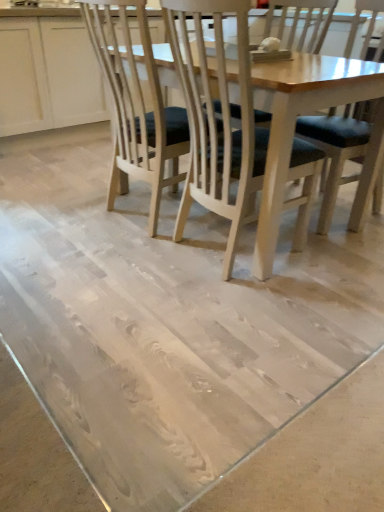
What is the approximate width of dark blue fabric chair at center, placed as the second chair when sorted from left to right?

The width of dark blue fabric chair at center, placed as the second chair when sorted from left to right, is 23.91 inches.

In order to face white wood cabinet at upper left, should I rotate leftwards or rightwards?

You should rotate left by 16.226 degrees.

You are a GUI agent. You are given a task and a screenshot of the screen. Output one action in this format:
    pyautogui.click(x=<x>, y=<y>)
    Task: Click on the dark blue fabric chair at center, placed as the second chair when sorted from left to right
    Image resolution: width=384 pixels, height=512 pixels.
    Given the screenshot: What is the action you would take?
    pyautogui.click(x=336, y=150)

Would you say white wood cabinet at upper left is outside dark blue fabric chair at center, which is the 1th chair in right-to-left order?

white wood cabinet at upper left lies outside dark blue fabric chair at center, which is the 1th chair in right-to-left order,'s area.

The height and width of the screenshot is (512, 384). Identify the location of the 2nd chair above the white wood cabinet at upper left (from a real-world perspective). (336, 150).

Can you tell me how much white wood cabinet at upper left and dark blue fabric chair at center, placed as the second chair when sorted from left to right, differ in facing direction?

The angle between the facing direction of white wood cabinet at upper left and the facing direction of dark blue fabric chair at center, placed as the second chair when sorted from left to right, is 88.8 degrees.

Which of these two, dark blue fabric chair at center, which is the 1th chair in right-to-left order, or white wood cabinet at upper left, is wider?

Wider between the two is white wood cabinet at upper left.

Which point is more forward, [322,231] or [1,74]?

The point [322,231] is closer to the camera.

Image resolution: width=384 pixels, height=512 pixels. Find the location of `cabinetry on the left of dark blue fabric chair at center, placed as the second chair when sorted from left to right`. cabinetry on the left of dark blue fabric chair at center, placed as the second chair when sorted from left to right is located at coordinates (48, 75).

From the image's perspective, is dark blue fabric chair at center, placed as the second chair when sorted from left to right, above or below white wood cabinet at upper left?

dark blue fabric chair at center, placed as the second chair when sorted from left to right, is below white wood cabinet at upper left.

Considering the relative positions of dark blue fabric chair at center, which is the 1th chair in right-to-left order, and wooden chair with dark cushion at center, which appears as the first chair when viewed from the left, in the image provided, is dark blue fabric chair at center, which is the 1th chair in right-to-left order, to the right of wooden chair with dark cushion at center, which appears as the first chair when viewed from the left, from the viewer's perspective?

Indeed, dark blue fabric chair at center, which is the 1th chair in right-to-left order, is positioned on the right side of wooden chair with dark cushion at center, which appears as the first chair when viewed from the left.

Considering the sizes of objects dark blue fabric chair at center, which is the 1th chair in right-to-left order, and wooden chair with dark cushion at center, which appears as the first chair when viewed from the left, in the image provided, who is shorter, dark blue fabric chair at center, which is the 1th chair in right-to-left order, or wooden chair with dark cushion at center, which appears as the first chair when viewed from the left,?

With less height is wooden chair with dark cushion at center, which appears as the first chair when viewed from the left.

From the image's perspective, is dark blue fabric chair at center, placed as the second chair when sorted from left to right, under wooden chair with dark cushion at center, which appears as the first chair when viewed from the left?

Yes, from the image's perspective, dark blue fabric chair at center, placed as the second chair when sorted from left to right, is below wooden chair with dark cushion at center, which appears as the first chair when viewed from the left.

From a real-world perspective, is wooden chair with dark cushion at center, which appears as the first chair when viewed from the left, under white wood cabinet at upper left?

Actually, wooden chair with dark cushion at center, which appears as the first chair when viewed from the left, is physically above white wood cabinet at upper left in the real world.

Which object is wider, wooden chair with dark cushion at center, which appears as the first chair when viewed from the left, or white wood cabinet at upper left?

Wider between the two is white wood cabinet at upper left.

From the image's perspective, is wooden chair with dark cushion at center, the 2th chair when ordered from right to left, located above or below white wood cabinet at upper left?

wooden chair with dark cushion at center, the 2th chair when ordered from right to left, is below white wood cabinet at upper left.

Is wooden chair with dark cushion at center, which appears as the first chair when viewed from the left, taller or shorter than white wood cabinet at upper left?

In the image, wooden chair with dark cushion at center, which appears as the first chair when viewed from the left, appears to be taller than white wood cabinet at upper left.

Is white wood cabinet at upper left oriented towards wooden chair with dark cushion at center, which appears as the first chair when viewed from the left?

Yes.

Is white wood cabinet at upper left positioned far away from wooden chair with dark cushion at center, the 2th chair when ordered from right to left?

Yes, white wood cabinet at upper left is far from wooden chair with dark cushion at center, the 2th chair when ordered from right to left.

Can you tell me how much white wood cabinet at upper left and wooden chair with dark cushion at center, the 2th chair when ordered from right to left, differ in facing direction?

white wood cabinet at upper left and wooden chair with dark cushion at center, the 2th chair when ordered from right to left, are facing 88.8 degrees away from each other.

Can you confirm if white wood cabinet at upper left is positioned to the right of wooden chair with dark cushion at center, the 2th chair when ordered from right to left?

In fact, white wood cabinet at upper left is to the left of wooden chair with dark cushion at center, the 2th chair when ordered from right to left.

Who is smaller, wooden chair with dark cushion at center, which appears as the first chair when viewed from the left, or dark blue fabric chair at center, which is the 1th chair in right-to-left order?

wooden chair with dark cushion at center, which appears as the first chair when viewed from the left.

Could you tell me if wooden chair with dark cushion at center, which appears as the first chair when viewed from the left, is turned towards dark blue fabric chair at center, which is the 1th chair in right-to-left order?

No, wooden chair with dark cushion at center, which appears as the first chair when viewed from the left, is not turned towards dark blue fabric chair at center, which is the 1th chair in right-to-left order.

From the image's perspective, which object appears higher, wooden chair with dark cushion at center, which appears as the first chair when viewed from the left, or dark blue fabric chair at center, placed as the second chair when sorted from left to right?

From the image's view, wooden chair with dark cushion at center, which appears as the first chair when viewed from the left, is above.

Do you think wooden chair with dark cushion at center, which appears as the first chair when viewed from the left, is within dark blue fabric chair at center, which is the 1th chair in right-to-left order, or outside of it?

wooden chair with dark cushion at center, which appears as the first chair when viewed from the left, is located beyond the bounds of dark blue fabric chair at center, which is the 1th chair in right-to-left order.

What are the coordinates of `the 2nd chair located above the white wood cabinet at upper left (from a real-world perspective)` in the screenshot? It's located at (336, 150).

Where is `cabinetry lying above the dark blue fabric chair at center, which is the 1th chair in right-to-left order (from the image's perspective)`? This screenshot has height=512, width=384. cabinetry lying above the dark blue fabric chair at center, which is the 1th chair in right-to-left order (from the image's perspective) is located at coordinates 48,75.

Based on their spatial positions, is wooden chair with dark cushion at center, the 2th chair when ordered from right to left, or white wood cabinet at upper left further from dark blue fabric chair at center, placed as the second chair when sorted from left to right?

white wood cabinet at upper left.

Estimate the real-world distances between objects in this image. Which object is further from wooden chair with dark cushion at center, which appears as the first chair when viewed from the left, white wood cabinet at upper left or dark blue fabric chair at center, placed as the second chair when sorted from left to right?

white wood cabinet at upper left.

Considering their positions, is dark blue fabric chair at center, which is the 1th chair in right-to-left order, positioned further to wooden chair with dark cushion at center, which appears as the first chair when viewed from the left, than white wood cabinet at upper left?

white wood cabinet at upper left lies further to wooden chair with dark cushion at center, which appears as the first chair when viewed from the left, than the other object.

From the image, which object appears to be farther from white wood cabinet at upper left, dark blue fabric chair at center, placed as the second chair when sorted from left to right, or wooden chair with dark cushion at center, which appears as the first chair when viewed from the left?

dark blue fabric chair at center, placed as the second chair when sorted from left to right, is further to white wood cabinet at upper left.

Estimate the real-world distances between objects in this image. Which object is closer to white wood cabinet at upper left, wooden chair with dark cushion at center, which appears as the first chair when viewed from the left, or dark blue fabric chair at center, placed as the second chair when sorted from left to right?

The object closer to white wood cabinet at upper left is wooden chair with dark cushion at center, which appears as the first chair when viewed from the left.

Considering their positions, is white wood cabinet at upper left positioned further to dark blue fabric chair at center, which is the 1th chair in right-to-left order, than wooden chair with dark cushion at center, the 2th chair when ordered from right to left?

white wood cabinet at upper left lies further to dark blue fabric chair at center, which is the 1th chair in right-to-left order, than the other object.

Image resolution: width=384 pixels, height=512 pixels. I want to click on chair between white wood cabinet at upper left and dark blue fabric chair at center, which is the 1th chair in right-to-left order, in the horizontal direction, so click(x=308, y=21).